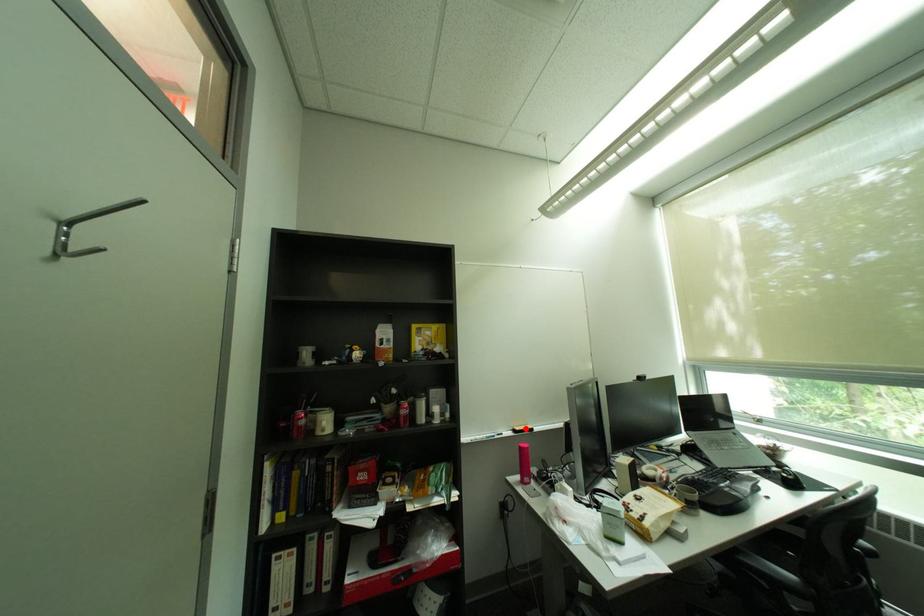
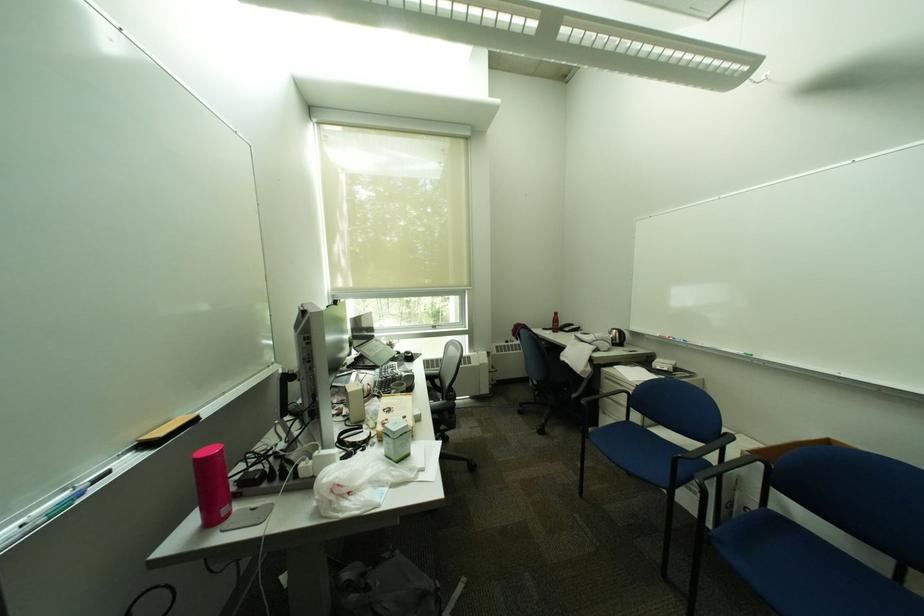
In the second image, find the point that corresponds to the highlighted location in the first image.

(155, 439)